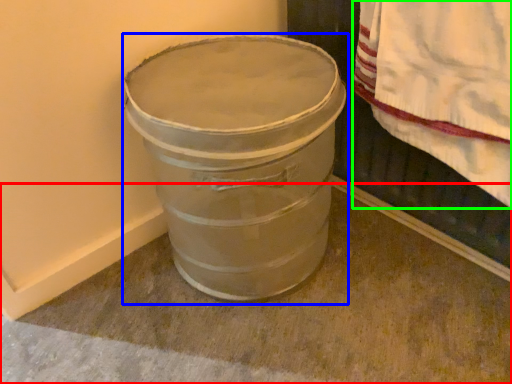
Question: Estimate the real-world distances between objects in this image. Which object is closer to concrete (highlighted by a red box), waste container (highlighted by a blue box) or blanket (highlighted by a green box)?

Choices:
 (A) waste container
 (B) blanket

Answer: (A)